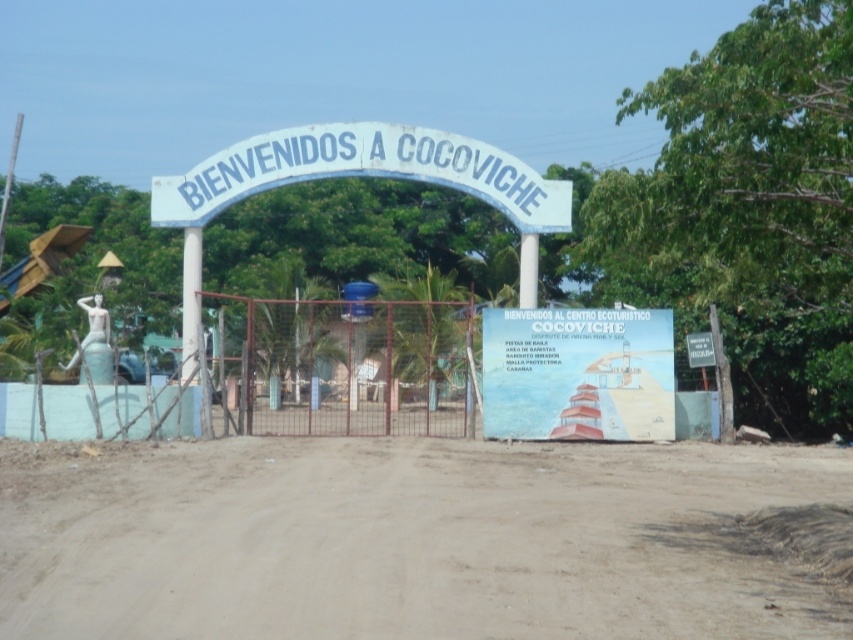
Question: Does brown sandy dirt track at center lie in front of white painted signboard at center?

Choices:
 (A) yes
 (B) no

Answer: (A)

Question: Which point is farther to the camera?

Choices:
 (A) brown sandy dirt track at center
 (B) white painted signboard at center
 (C) white painted wood sign at center

Answer: (C)

Question: Is brown sandy dirt track at center positioned before white painted wood sign at center?

Choices:
 (A) no
 (B) yes

Answer: (B)

Question: Which object is closer to the camera taking this photo?

Choices:
 (A) brown sandy dirt track at center
 (B) white painted signboard at center

Answer: (A)

Question: Which object is closer to the camera taking this photo?

Choices:
 (A) white painted signboard at center
 (B) white painted wood sign at center

Answer: (A)

Question: Can you confirm if brown sandy dirt track at center is thinner than white painted signboard at center?

Choices:
 (A) no
 (B) yes

Answer: (A)